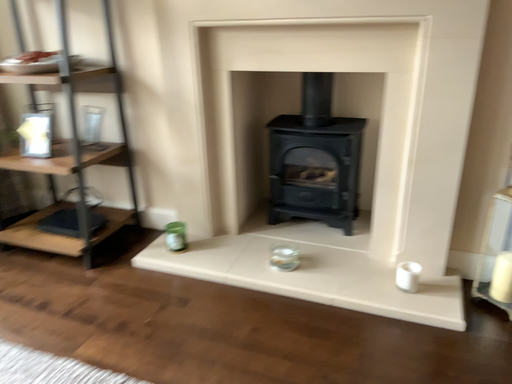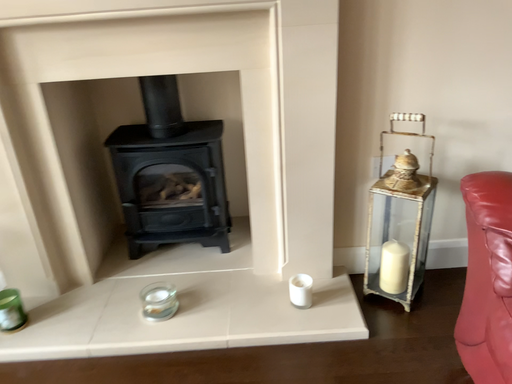
Question: How did the camera likely rotate when shooting the video?

Choices:
 (A) rotated left
 (B) rotated right

Answer: (B)